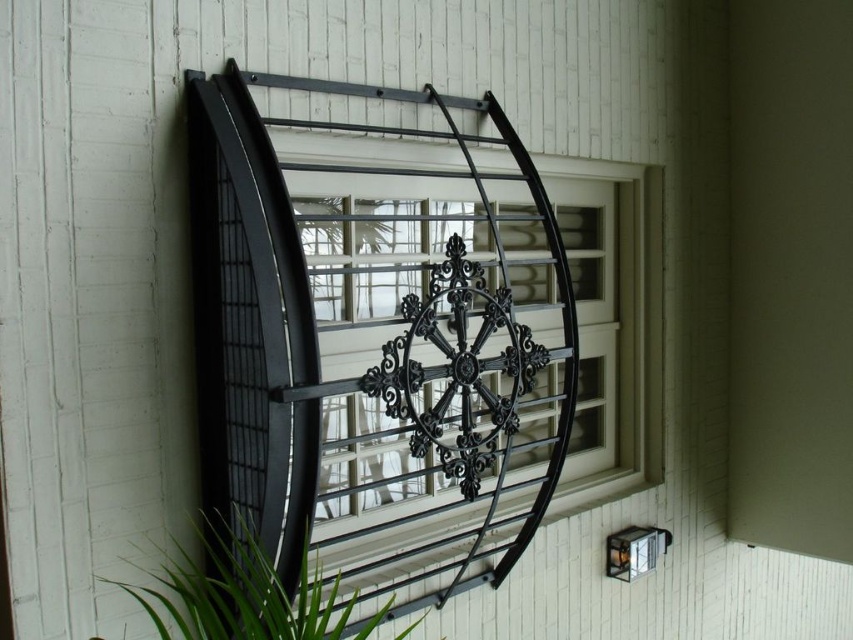
You are standing in front of a building with a decorative metal grille over a window. The grille has a circular design with intricate patterns. There is a specific point marked at coordinates point (412, 333). What is located at this point?

The black metal grille at upper center is located at point (412, 333).

You are standing in front of a building with a decorative metal grille over a window. You want to take a photo of the point at coordinate (518, 180) on the grille. If your camera can focus on objects up to 3 meters away, will you be able to take a clear photo of that point?

The point at coordinate (518, 180) and the viewer are 3.27 meters apart. Since the camera can focus up to 3 meters, the distance is too far, so the photo may not be clear.